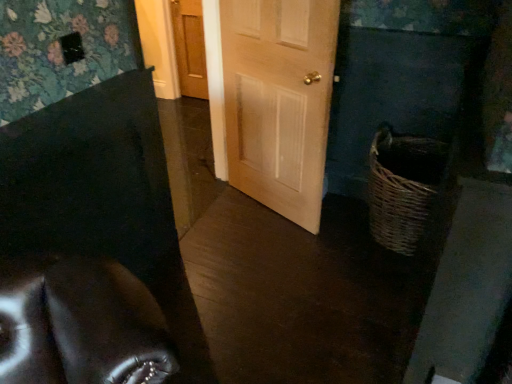
Find the location of a particular element. The height and width of the screenshot is (384, 512). vacant space underneath light wood door at center, which appears as the 2th door when viewed from the back (from a real-world perspective) is located at coordinates (266, 213).